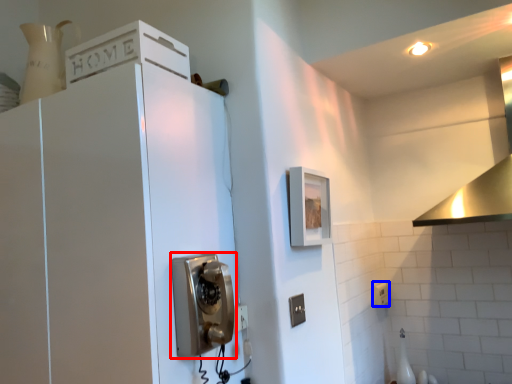
Question: Which point is further to the camera, corded phone (highlighted by a red box) or electric outlet (highlighted by a blue box)?

Choices:
 (A) corded phone
 (B) electric outlet

Answer: (B)